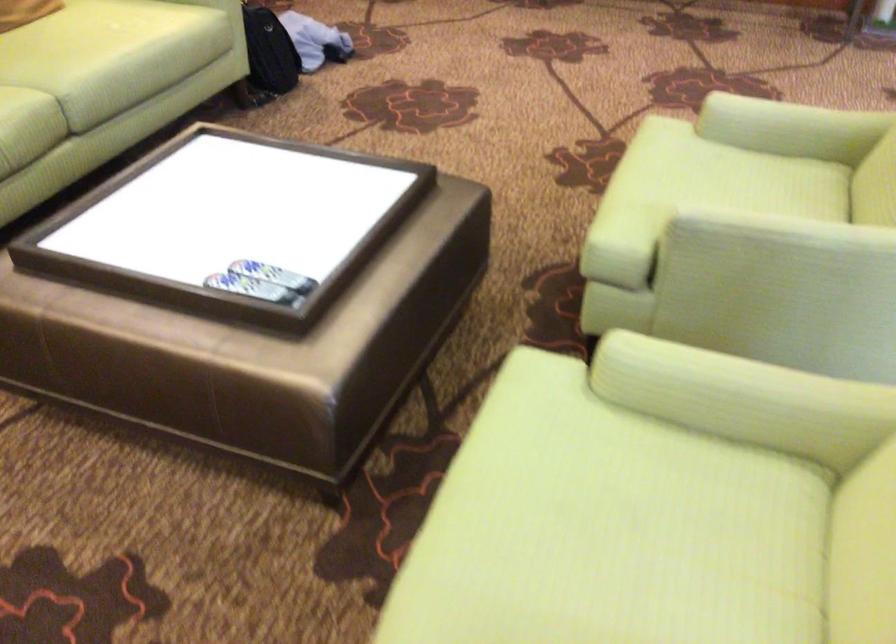
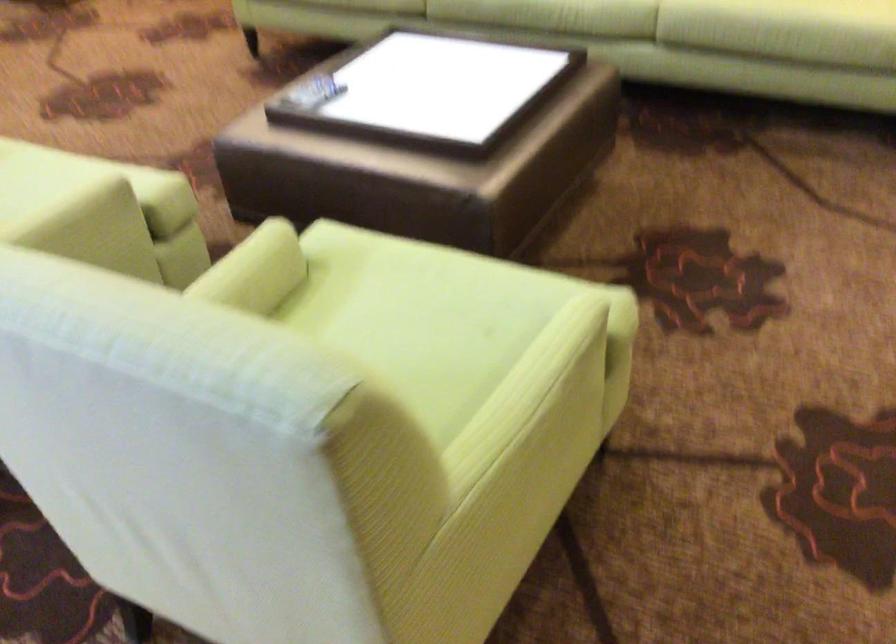
Question: I am providing you with two images of the same scene from different viewpoints. Please identify which objects are invisible in image2.

Choices:
 (A) chair sitting surface
 (B) sofa sitting surface
 (C) light green armrest
 (D) none of these

Answer: (D)